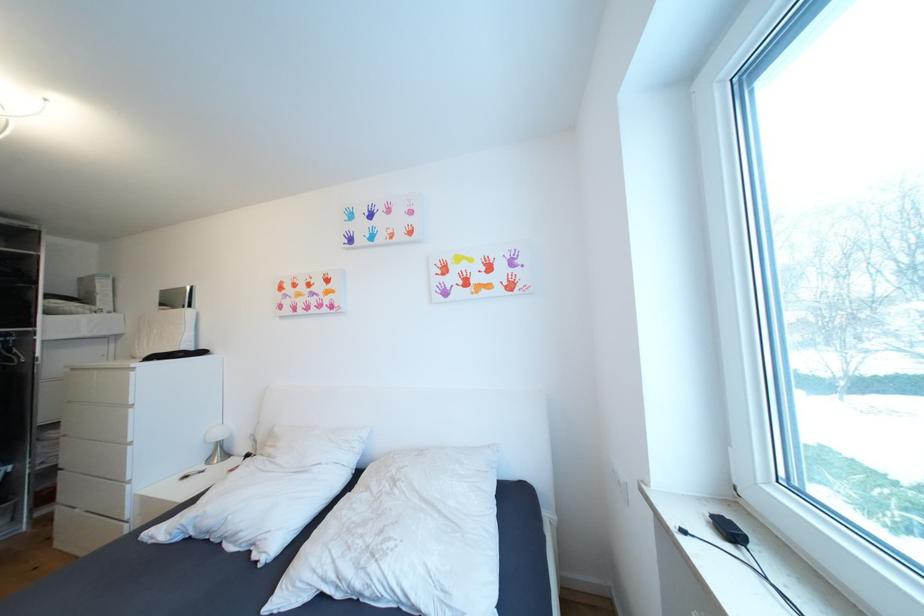
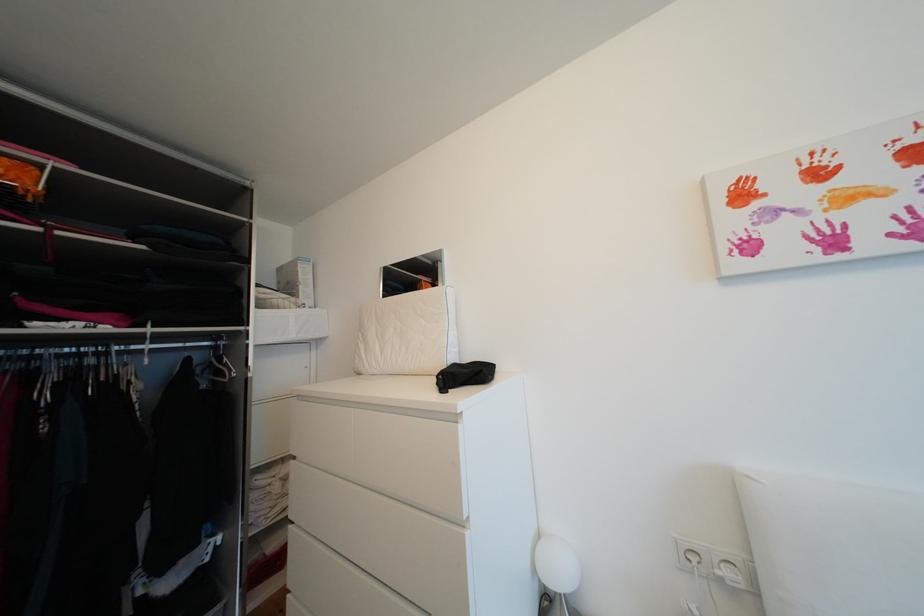
In a continuous first-person perspective shot, in which direction is the camera moving?

The cameraman moved toward left, forward.